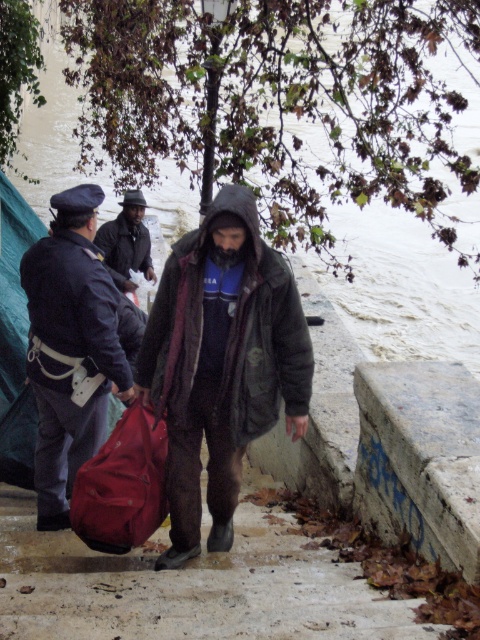
Question: Based on their relative distances, which object is nearer to the brown leather bag at lower left?

Choices:
 (A) matte black jacket at center
 (B) concrete steps at center
 (C) dark brown fur coat at center
 (D) matte red bag at lower left

Answer: (C)

Question: Estimate the real-world distances between objects in this image. Which object is farther from the dark brown leather jacket at center?

Choices:
 (A) brown leather bag at lower left
 (B) concrete steps at center
 (C) matte red bag at lower left
 (D) green fabric tent at left

Answer: (C)

Question: Which object is positioned closest to the matte red bag at lower left?

Choices:
 (A) green fabric tent at left
 (B) concrete steps at center
 (C) brown leather bag at lower left

Answer: (B)

Question: Is brown leather bag at lower left to the left of green fabric tent at left from the viewer's perspective?

Choices:
 (A) no
 (B) yes

Answer: (A)

Question: Does concrete steps at center have a lesser width compared to matte red bag at lower left?

Choices:
 (A) no
 (B) yes

Answer: (A)

Question: Can you confirm if dark brown fur coat at center is bigger than green fabric tent at left?

Choices:
 (A) yes
 (B) no

Answer: (B)